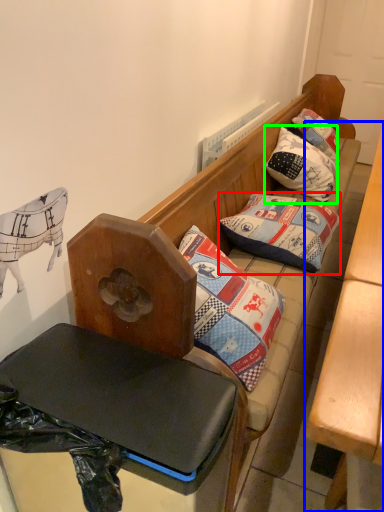
Question: Considering the real-world distances, which object is closest to pillow (highlighted by a red box)? table (highlighted by a blue box) or pillow (highlighted by a green box).

Choices:
 (A) table
 (B) pillow

Answer: (A)